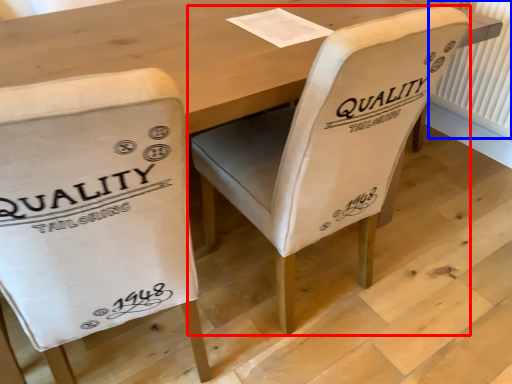
Question: Among these objects, which one is farthest to the camera, chair (highlighted by a red box) or radiator (highlighted by a blue box)?

Choices:
 (A) chair
 (B) radiator

Answer: (B)